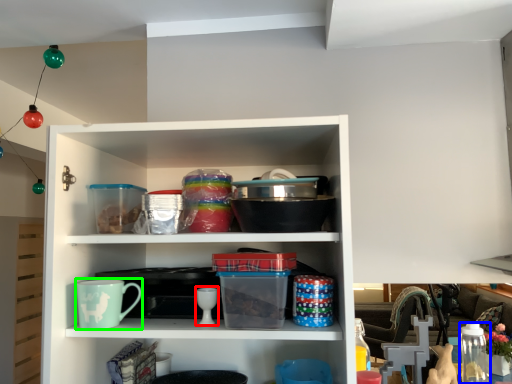
Question: Which is farther away from tableware (highlighted by a red box)? glass jar (highlighted by a blue box) or mug (highlighted by a green box)?

Choices:
 (A) glass jar
 (B) mug

Answer: (A)